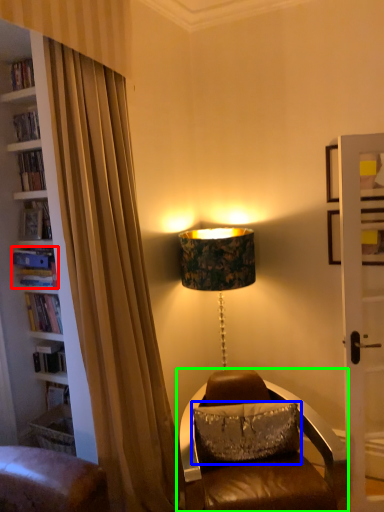
Question: Which object is the closest to the book (highlighted by a red box)? Choose among these: pillow (highlighted by a blue box) or chair (highlighted by a green box).

Choices:
 (A) pillow
 (B) chair

Answer: (A)